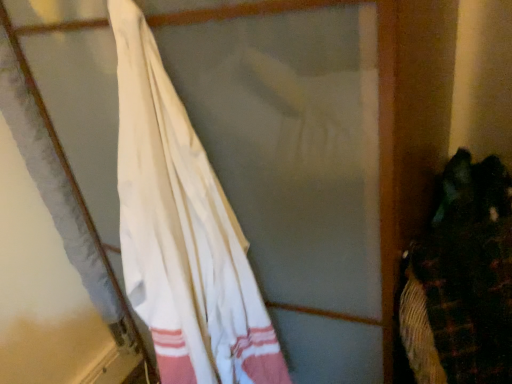
Question: In the image, is dark green fabric at right positioned in front of or behind white cotton towel at left?

Choices:
 (A) front
 (B) behind

Answer: (B)

Question: Is dark green fabric at right to the left or to the right of white cotton towel at left in the image?

Choices:
 (A) left
 (B) right

Answer: (B)

Question: Is point (484, 243) closer or farther from the camera than point (280, 364)?

Choices:
 (A) farther
 (B) closer

Answer: (B)

Question: From the image's perspective, is white cotton towel at left above or below dark green fabric at right?

Choices:
 (A) below
 (B) above

Answer: (B)

Question: In the image, is white cotton towel at left on the left side or the right side of dark green fabric at right?

Choices:
 (A) right
 (B) left

Answer: (B)

Question: Does point (179, 216) appear closer or farther from the camera than point (412, 337)?

Choices:
 (A) closer
 (B) farther

Answer: (B)

Question: From a real-world perspective, is white cotton towel at left positioned above or below dark green fabric at right?

Choices:
 (A) below
 (B) above

Answer: (B)